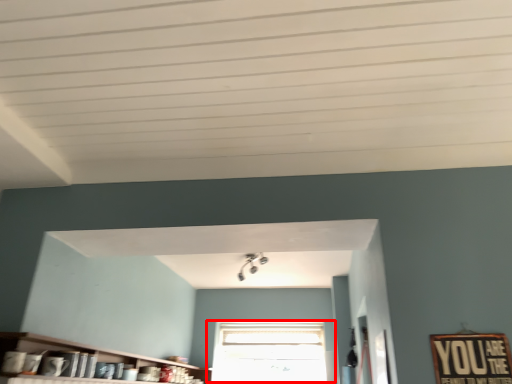
Question: In this image, where is window (annotated by the red box) located relative to shelf?

Choices:
 (A) right
 (B) left

Answer: (A)